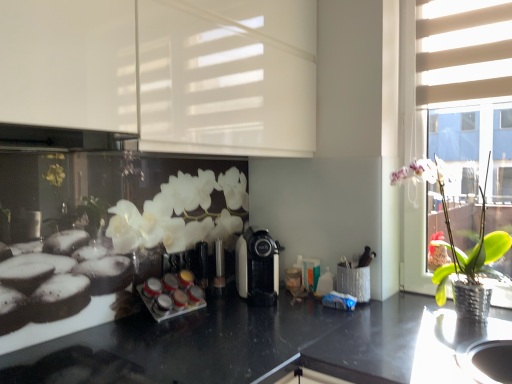
Consider the image. Measure the distance between point (170, 280) and camera.

Point (170, 280) and camera are 5.22 feet apart.

Locate an element on the screen. This screenshot has height=384, width=512. white glossy cabinet at upper left, positioned as the second shutter in right-to-left order is located at coordinates (228, 77).

Is white glossy cabinet at upper left, acting as the first shutter starting from the left, inside green leafy plant in metallic pot at right?

No.

Which object is further away from the camera taking this photo, green leafy plant in metallic pot at right or white glossy cabinet at upper left, positioned as the second shutter in right-to-left order?

Positioned behind is green leafy plant in metallic pot at right.

In terms of width, does green leafy plant in metallic pot at right look wider or thinner when compared to white glossy cabinet at upper left, positioned as the second shutter in right-to-left order?

In the image, green leafy plant in metallic pot at right appears to be more narrow than white glossy cabinet at upper left, positioned as the second shutter in right-to-left order.

Is point (298, 29) in front of point (255, 256)?

No, it is behind (255, 256).

Looking at this image, could you tell me if white glossy cabinet at upper left, positioned as the second shutter in right-to-left order, is turned towards black plastic coffee machine at center?

No, white glossy cabinet at upper left, positioned as the second shutter in right-to-left order, is not oriented towards black plastic coffee machine at center.

Which of these two, white glossy cabinet at upper left, positioned as the second shutter in right-to-left order, or black plastic coffee machine at center, is wider?

black plastic coffee machine at center is wider.

Identify the location of coffee machine behind the white glossy cabinet at upper left, acting as the first shutter starting from the left. The height and width of the screenshot is (384, 512). (257, 267).

Based on the photo, does white glossy cabinet at upper left, positioned as the second shutter in right-to-left order, appear on the left side of green leafy plant in metallic pot at right?

Yes.

From a real-world perspective, which is physically above, white glossy cabinet at upper left, acting as the first shutter starting from the left, or green leafy plant in metallic pot at right?

From a 3D spatial view, white glossy cabinet at upper left, acting as the first shutter starting from the left, is above.

Can you confirm if white glossy cabinet at upper left, acting as the first shutter starting from the left, is thinner than green leafy plant in metallic pot at right?

No, white glossy cabinet at upper left, acting as the first shutter starting from the left, is not thinner than green leafy plant in metallic pot at right.

From the image's perspective, between black plastic coffee machine at center and beige fabric blinds at upper right, the 1th shutter positioned from the right, which one is located above?

beige fabric blinds at upper right, the 1th shutter positioned from the right.

The width and height of the screenshot is (512, 384). Identify the location of coffee machine located behind the beige fabric blinds at upper right, the 1th shutter positioned from the right. (257, 267).

Based on their sizes in the image, would you say black plastic coffee machine at center is bigger or smaller than beige fabric blinds at upper right, the 1th shutter positioned from the right?

Clearly, black plastic coffee machine at center is larger in size than beige fabric blinds at upper right, the 1th shutter positioned from the right.

From a real-world perspective, between black plastic coffee machine at center and beige fabric blinds at upper right, which is the 2th shutter from left to right, who is vertically lower?

black plastic coffee machine at center is physically lower.

Looking at their sizes, would you say black plastic coffee machine at center is wider or thinner than green leafy plant in metallic pot at right?

black plastic coffee machine at center is wider than green leafy plant in metallic pot at right.

Can you tell me how much black plastic coffee machine at center and green leafy plant in metallic pot at right differ in facing direction?

46 degrees separate the facing orientations of black plastic coffee machine at center and green leafy plant in metallic pot at right.

Can we say black plastic coffee machine at center lies outside green leafy plant in metallic pot at right?

Indeed, black plastic coffee machine at center is completely outside green leafy plant in metallic pot at right.

In terms of size, does black plastic coffee machine at center appear bigger or smaller than green leafy plant in metallic pot at right?

black plastic coffee machine at center is smaller than green leafy plant in metallic pot at right.

Is white glossy cabinet at upper left, acting as the first shutter starting from the left, touching beige fabric blinds at upper right, which is the 2th shutter from left to right?

No, white glossy cabinet at upper left, acting as the first shutter starting from the left, is not beside beige fabric blinds at upper right, which is the 2th shutter from left to right.

Identify the location of shutter above the white glossy cabinet at upper left, positioned as the second shutter in right-to-left order (from the image's perspective). (463, 51).

Does white glossy cabinet at upper left, acting as the first shutter starting from the left, have a lesser width compared to beige fabric blinds at upper right, the 1th shutter positioned from the right?

No.

Which object is more forward, white glossy spice rack at center or black plastic coffee machine at center?

white glossy spice rack at center is closer to the camera.

Is white glossy spice rack at center not close to black plastic coffee machine at center?

No, white glossy spice rack at center is not far away from black plastic coffee machine at center.

You are a GUI agent. You are given a task and a screenshot of the screen. Output one action in this format:
    pyautogui.click(x=<x>, y=<y>)
    Task: Click on the appliance beneath the black plastic coffee machine at center (from a real-world perspective)
    This screenshot has width=512, height=384.
    Given the screenshot: What is the action you would take?
    pyautogui.click(x=169, y=297)

How far apart are white glossy spice rack at center and black plastic coffee machine at center?

white glossy spice rack at center and black plastic coffee machine at center are 11.66 inches apart.

Identify the location of houseplant below the white glossy cabinet at upper left, positioned as the second shutter in right-to-left order (from a real-world perspective). The width and height of the screenshot is (512, 384). (452, 233).

At what (x,y) coordinates should I click in order to perform the action: click on shutter on the left of the black plastic coffee machine at center. Please return your answer as a coordinate pair (x, y). Looking at the image, I should click on (228, 77).

When comparing their distances from green leafy plant in metallic pot at right, does white glossy cabinet at upper left, acting as the first shutter starting from the left, or white glossy spice rack at center seem further?

white glossy spice rack at center is further to green leafy plant in metallic pot at right.

From the image, which object appears to be nearer to white glossy spice rack at center, green leafy plant in metallic pot at right or white glossy cabinet at upper left, positioned as the second shutter in right-to-left order?

white glossy cabinet at upper left, positioned as the second shutter in right-to-left order, is closer to white glossy spice rack at center.

From the picture: Which object lies further to the anchor point white glossy cabinet at upper left, acting as the first shutter starting from the left, beige fabric blinds at upper right, the 1th shutter positioned from the right, or black plastic coffee machine at center?

beige fabric blinds at upper right, the 1th shutter positioned from the right, is further to white glossy cabinet at upper left, acting as the first shutter starting from the left.

From the image, which object appears to be nearer to white glossy spice rack at center, white glossy cabinet at upper left, positioned as the second shutter in right-to-left order, or beige fabric blinds at upper right, the 1th shutter positioned from the right?

white glossy cabinet at upper left, positioned as the second shutter in right-to-left order.

Considering their positions, is black plastic coffee machine at center positioned closer to white glossy spice rack at center than green leafy plant in metallic pot at right?

black plastic coffee machine at center.

Looking at the image, which one is located closer to white glossy cabinet at upper left, acting as the first shutter starting from the left, white glossy spice rack at center or beige fabric blinds at upper right, which is the 2th shutter from left to right?

beige fabric blinds at upper right, which is the 2th shutter from left to right, is positioned closer to the anchor white glossy cabinet at upper left, acting as the first shutter starting from the left.

Estimate the real-world distances between objects in this image. Which object is further from beige fabric blinds at upper right, which is the 2th shutter from left to right, white glossy cabinet at upper left, acting as the first shutter starting from the left, or black plastic coffee machine at center?

Among the two, black plastic coffee machine at center is located further to beige fabric blinds at upper right, which is the 2th shutter from left to right.

Based on their spatial positions, is beige fabric blinds at upper right, which is the 2th shutter from left to right, or green leafy plant in metallic pot at right further from white glossy cabinet at upper left, acting as the first shutter starting from the left?

green leafy plant in metallic pot at right is further to white glossy cabinet at upper left, acting as the first shutter starting from the left.

Where is `shutter between white glossy spice rack at center and green leafy plant in metallic pot at right in the horizontal direction`? This screenshot has width=512, height=384. shutter between white glossy spice rack at center and green leafy plant in metallic pot at right in the horizontal direction is located at coordinates coord(228,77).

Image resolution: width=512 pixels, height=384 pixels. Find the location of `shutter situated between white glossy spice rack at center and beige fabric blinds at upper right, which is the 2th shutter from left to right, from left to right`. shutter situated between white glossy spice rack at center and beige fabric blinds at upper right, which is the 2th shutter from left to right, from left to right is located at coordinates (228, 77).

The width and height of the screenshot is (512, 384). What are the coordinates of `coffee machine located between white glossy spice rack at center and beige fabric blinds at upper right, the 1th shutter positioned from the right, in the left-right direction` in the screenshot? It's located at (257, 267).

Image resolution: width=512 pixels, height=384 pixels. I want to click on houseplant situated between white glossy cabinet at upper left, acting as the first shutter starting from the left, and beige fabric blinds at upper right, the 1th shutter positioned from the right, from left to right, so click(x=452, y=233).